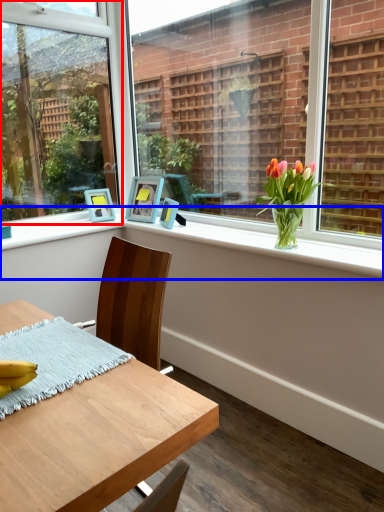
Question: Among these objects, which one is nearest to the camera, window (highlighted by a red box) or window sill (highlighted by a blue box)?

Choices:
 (A) window
 (B) window sill

Answer: (B)